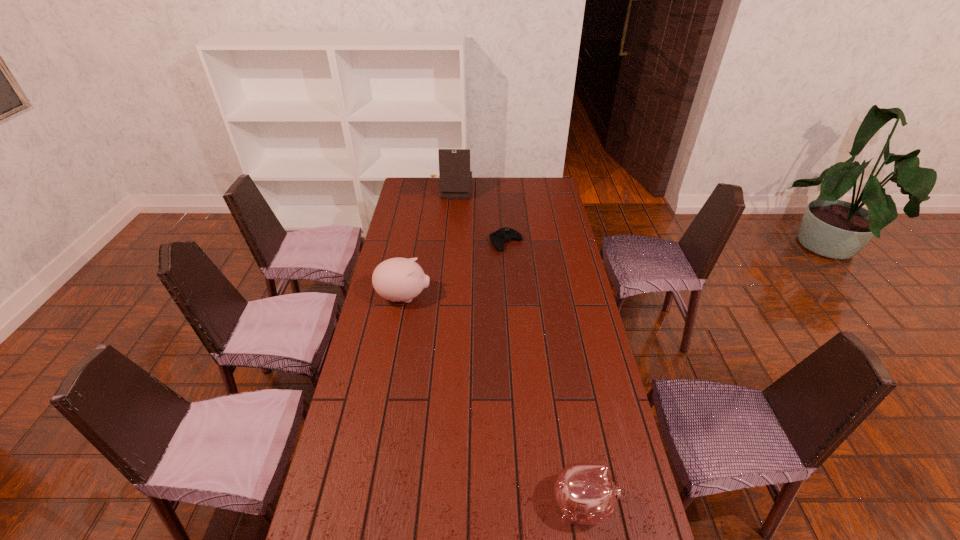
Where is `phonograph record`? The width and height of the screenshot is (960, 540). phonograph record is located at coordinates (455, 176).

You are a GUI agent. You are given a task and a screenshot of the screen. Output one action in this format:
    pyautogui.click(x=<x>, y=<y>)
    Task: Click on the tallest object
    The image size is (960, 540).
    Given the screenshot: What is the action you would take?
    pyautogui.click(x=455, y=176)

This screenshot has width=960, height=540. What are the coordinates of `the third shortest object` in the screenshot? It's located at (398, 279).

The height and width of the screenshot is (540, 960). I want to click on the taller piggy bank, so (x=398, y=279).

Find the location of a particular element. the right piggy bank is located at coordinates 585,493.

At what (x,y) coordinates should I click in order to perform the action: click on the shorter piggy bank. Please return your answer as a coordinate pair (x, y). Looking at the image, I should click on (585, 493).

This screenshot has width=960, height=540. I want to click on the second farthest object, so click(498, 238).

You are a GUI agent. You are given a task and a screenshot of the screen. Output one action in this format:
    pyautogui.click(x=<x>, y=<y>)
    Task: Click on the shortest object
    This screenshot has height=540, width=960.
    Given the screenshot: What is the action you would take?
    pyautogui.click(x=498, y=238)

Identify the location of vacant area situated on the right of the phonograph record. (496, 190).

Image resolution: width=960 pixels, height=540 pixels. Find the location of `blank space located 0.320m at the snout of the taller piggy bank`. blank space located 0.320m at the snout of the taller piggy bank is located at coordinates (512, 297).